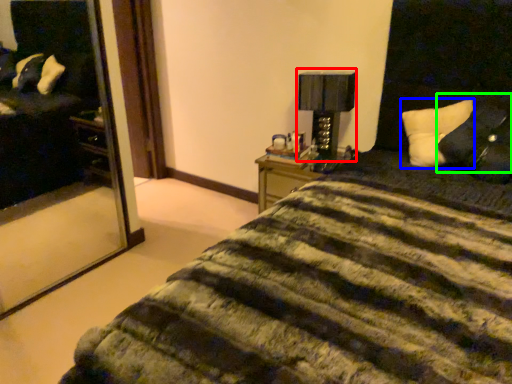
Question: Considering the real-world distances, which object is farthest from table lamp (highlighted by a red box)? pillow (highlighted by a blue box) or pillow (highlighted by a green box)?

Choices:
 (A) pillow
 (B) pillow

Answer: (B)